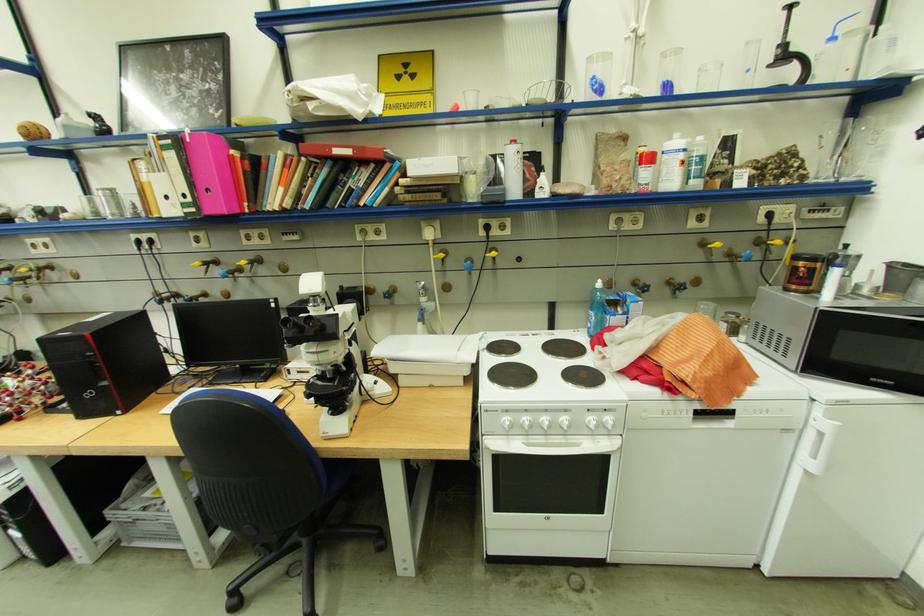
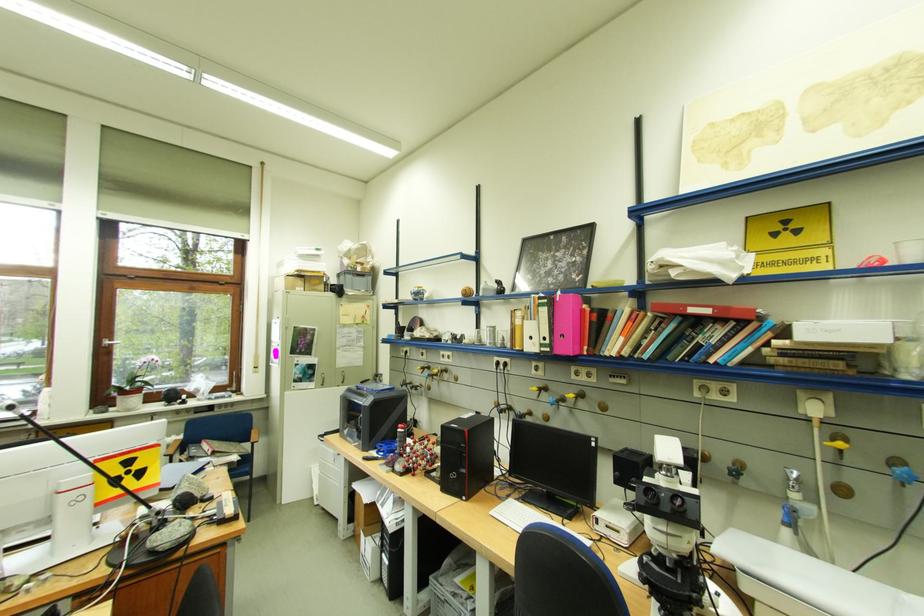
The point at (209, 265) is marked in the first image. Where is the corresponding point in the second image?

(544, 390)